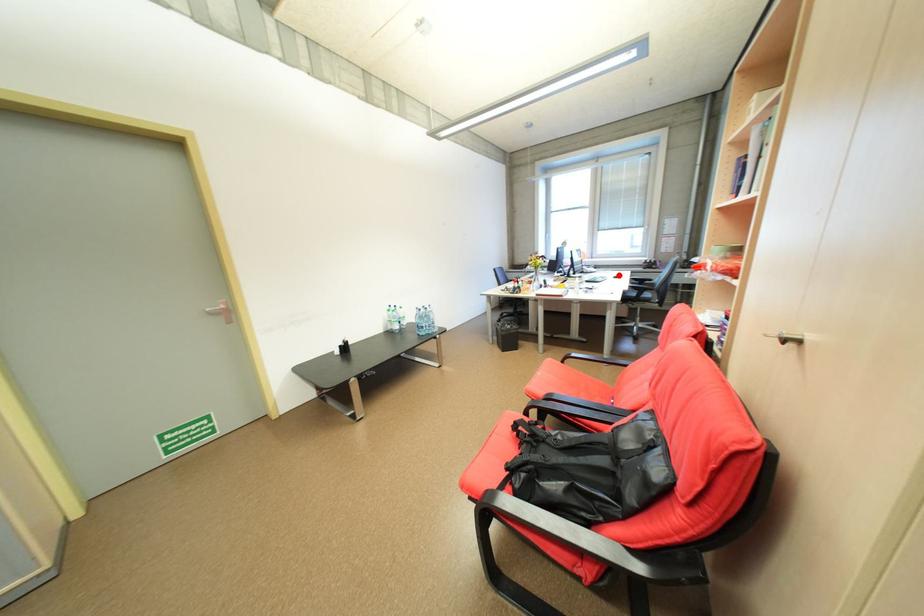
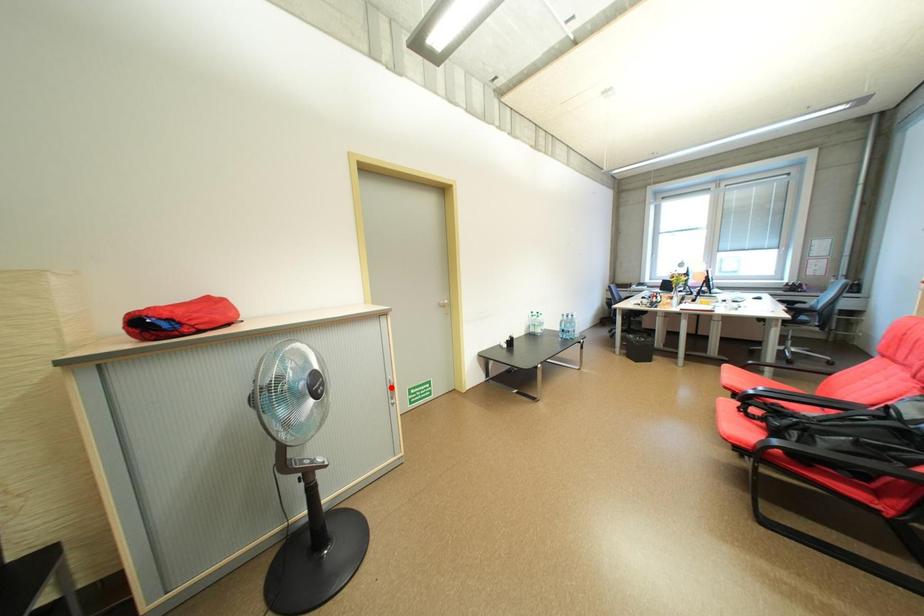
I am providing you with two images of the same scene from different viewpoints. A red point is marked on the first image and another point is marked on the second image. Are the points marked in image1 and image2 representing the same 3D position?

No